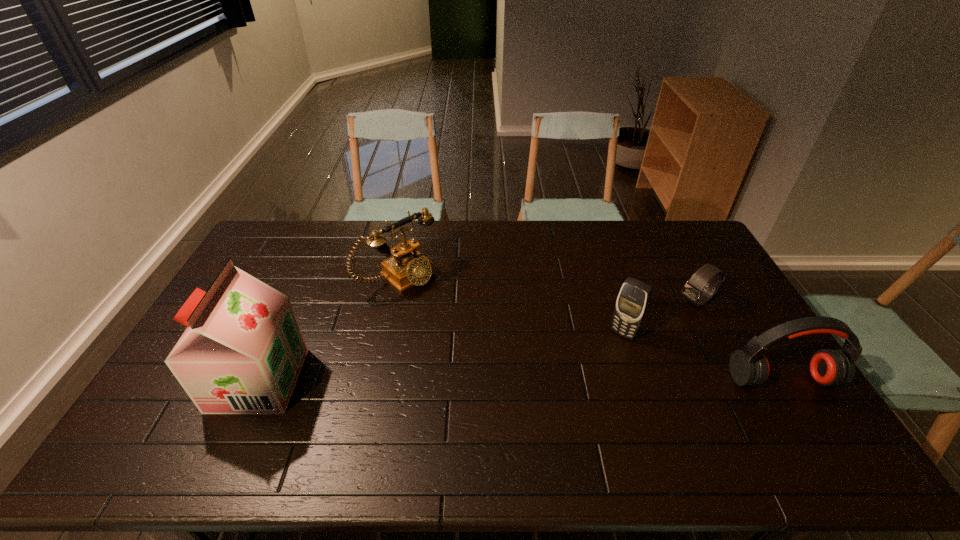
Identify the location of object at the far edge. The width and height of the screenshot is (960, 540). (406, 267).

This screenshot has width=960, height=540. I want to click on object at the near edge, so click(242, 352).

Locate an element on the screen. The width and height of the screenshot is (960, 540). object located in the left edge section of the desktop is located at coordinates (242, 352).

Locate an element on the screen. The height and width of the screenshot is (540, 960). earphone present at the right edge is located at coordinates click(749, 367).

In order to click on watch at the right edge in this screenshot , I will do `click(693, 292)`.

Where is `object that is at the near left corner`? The width and height of the screenshot is (960, 540). object that is at the near left corner is located at coordinates (242, 352).

The image size is (960, 540). What are the coordinates of `free space at the far edge` in the screenshot? It's located at (550, 234).

At what (x,y) coordinates should I click in order to perform the action: click on vacant space at the near edge of the desktop. Please return your answer as a coordinate pair (x, y). This screenshot has height=540, width=960. Looking at the image, I should click on (469, 406).

The image size is (960, 540). Identify the location of vacant space at the right edge. (723, 303).

You are a GUI agent. You are given a task and a screenshot of the screen. Output one action in this format:
    pyautogui.click(x=<x>, y=<y>)
    Task: Click on the vacant space at the far left corner of the desktop
    
    Given the screenshot: What is the action you would take?
    pyautogui.click(x=268, y=248)